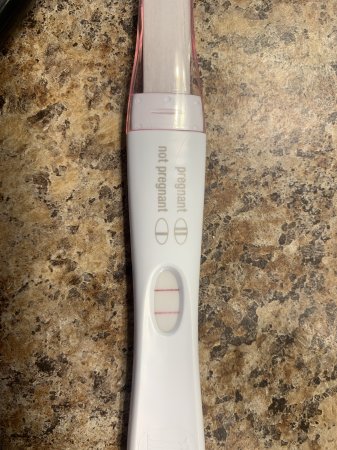
Find the location of a particular element. This screenshot has width=337, height=450. table/counter of part brown light is located at coordinates (294, 96), (88, 183), (289, 311), (262, 93), (289, 55).